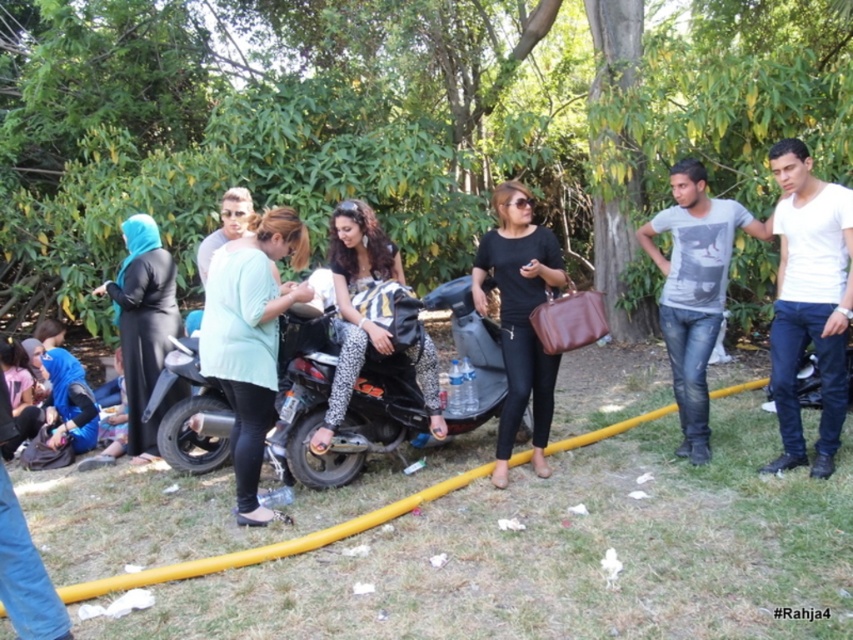
Is black matte motorcycle at center positioned behind green matte shirt at center?

Yes, it is behind green matte shirt at center.

Can you confirm if black matte motorcycle at center is positioned to the right of green matte shirt at center?

Indeed, black matte motorcycle at center is positioned on the right side of green matte shirt at center.

Where is `black matte motorcycle at center`? black matte motorcycle at center is located at coordinates (379, 388).

Who is more forward, (704, 328) or (506, 348)?

Point (506, 348)

Which is behind, point (728, 209) or point (514, 257)?

The point (728, 209) is more distant.

Between point (695, 412) and point (495, 189), which one is positioned behind?

Point (695, 412)

You are a GUI agent. You are given a task and a screenshot of the screen. Output one action in this format:
    pyautogui.click(x=<x>, y=<y>)
    Task: Click on the light gray printed t-shirt at right
    This screenshot has width=853, height=640.
    Given the screenshot: What is the action you would take?
    pyautogui.click(x=694, y=289)

Who is taller, leopard print leggings at center or blue matte hijab at left?

blue matte hijab at left

Who is lower down, leopard print leggings at center or blue matte hijab at left?

Positioned lower is blue matte hijab at left.

What are the coordinates of `leopard print leggings at center` in the screenshot? It's located at pos(351,300).

Where is `leopard print leggings at center`? leopard print leggings at center is located at coordinates (351, 300).